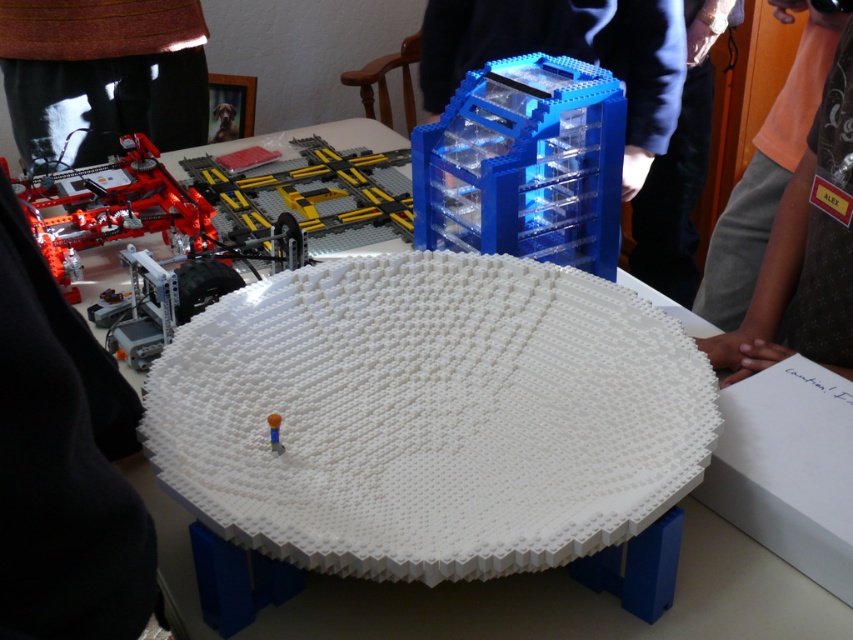
Question: Can you confirm if gray fabric shirt at upper right is positioned to the left of translucent plastic stick at center?

Choices:
 (A) no
 (B) yes

Answer: (A)

Question: Which of the following is the farthest from the observer?

Choices:
 (A) white plastic plate at center
 (B) translucent plastic stick at center

Answer: (B)

Question: Which point is closer to the camera taking this photo?

Choices:
 (A) (840, 320)
 (B) (563, 237)

Answer: (A)

Question: Does white plastic plate at center have a lesser width compared to orange fabric shirt at upper right?

Choices:
 (A) no
 (B) yes

Answer: (A)

Question: Which object is positioned farthest from the gray fabric shirt at upper right?

Choices:
 (A) transparent blue cube at center
 (B) white plastic plate at center
 (C) orange fabric shirt at upper right

Answer: (B)

Question: Where is gray fabric shirt at upper right located in relation to translucent plastic stick at center in the image?

Choices:
 (A) above
 (B) below

Answer: (A)